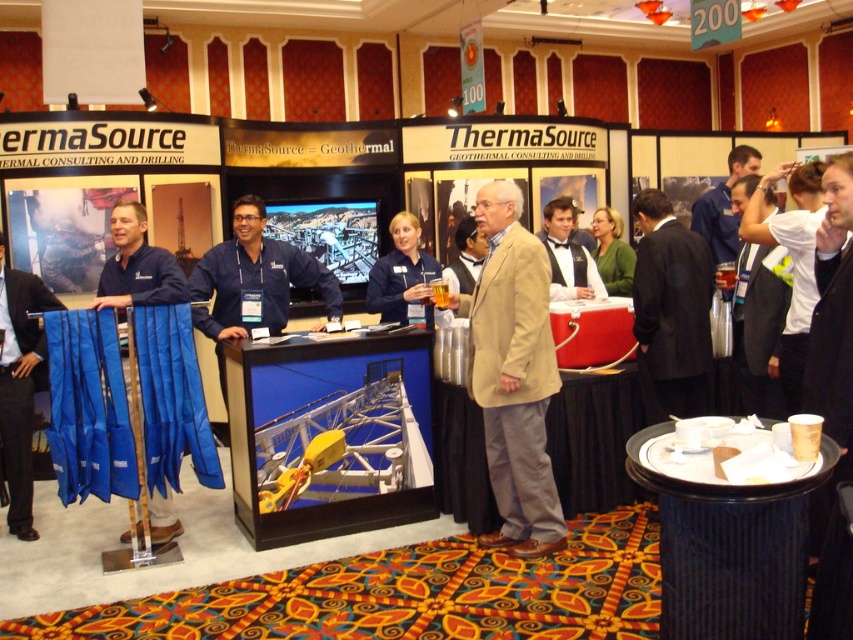
Is black suit at right positioned at the back of blue fabric at center?

That is True.

Does black suit at right have a smaller size compared to blue fabric at center?

Incorrect, black suit at right is not smaller in size than blue fabric at center.

Which is behind, point (651, 192) or point (160, 260)?

The point (651, 192) is behind.

I want to click on black suit at right, so click(x=671, y=307).

Who is more distant from viewer, [412,227] or [567,280]?

Positioned behind is point [567,280].

Measure the distance from blue uniform at center to light brown suit at center.

32.97 inches

I want to click on blue uniform at center, so click(x=401, y=275).

In the scene shown: Between tan fabric coat at center and black suit at right, which one appears on the right side from the viewer's perspective?

From the viewer's perspective, black suit at right appears more on the right side.

Is tan fabric coat at center thinner than black suit at right?

Correct, tan fabric coat at center's width is less than black suit at right's.

The width and height of the screenshot is (853, 640). What are the coordinates of `tan fabric coat at center` in the screenshot? It's located at (514, 374).

In order to click on tan fabric coat at center in this screenshot , I will do click(514, 374).